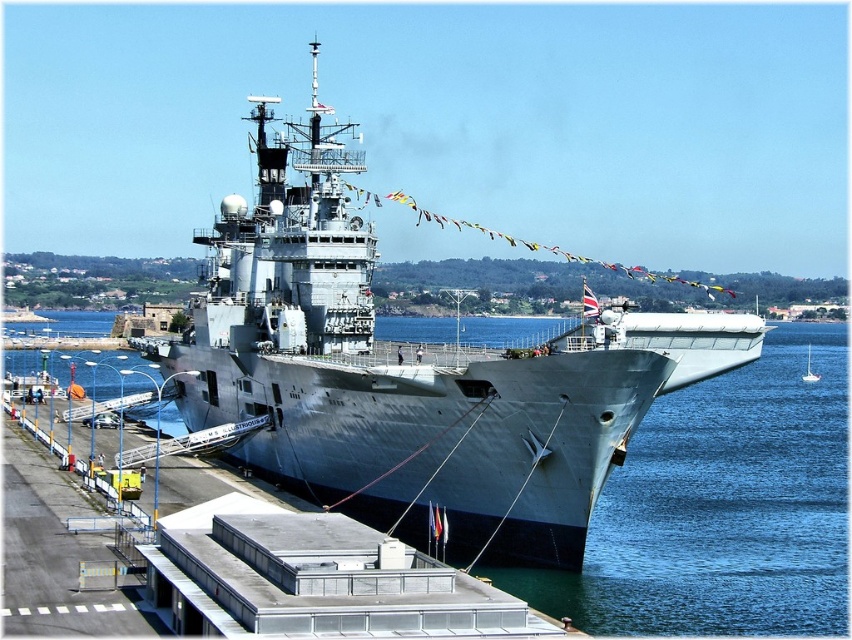
Is gray metallic ship at center smaller than gray metallic water at center?

Incorrect, gray metallic ship at center is not smaller in size than gray metallic water at center.

What do you see at coordinates (410, 372) in the screenshot? I see `gray metallic ship at center` at bounding box center [410, 372].

Image resolution: width=852 pixels, height=640 pixels. Find the location of `gray metallic ship at center`. gray metallic ship at center is located at coordinates pos(410,372).

Is point (724, 424) positioned before point (807, 364)?

Yes, it is.

From the picture: Does gray metallic water at center appear on the right side of white glossy sailboat at center?

In fact, gray metallic water at center is to the left of white glossy sailboat at center.

Where is `gray metallic water at center`? The width and height of the screenshot is (852, 640). gray metallic water at center is located at coordinates (x=723, y=508).

Does gray metallic ship at center have a greater width compared to white glossy sailboat at center?

Yes, gray metallic ship at center is wider than white glossy sailboat at center.

Does point (502, 486) come in front of point (807, 349)?

Yes, it is.

Locate an element on the screen. gray metallic ship at center is located at coordinates 410,372.